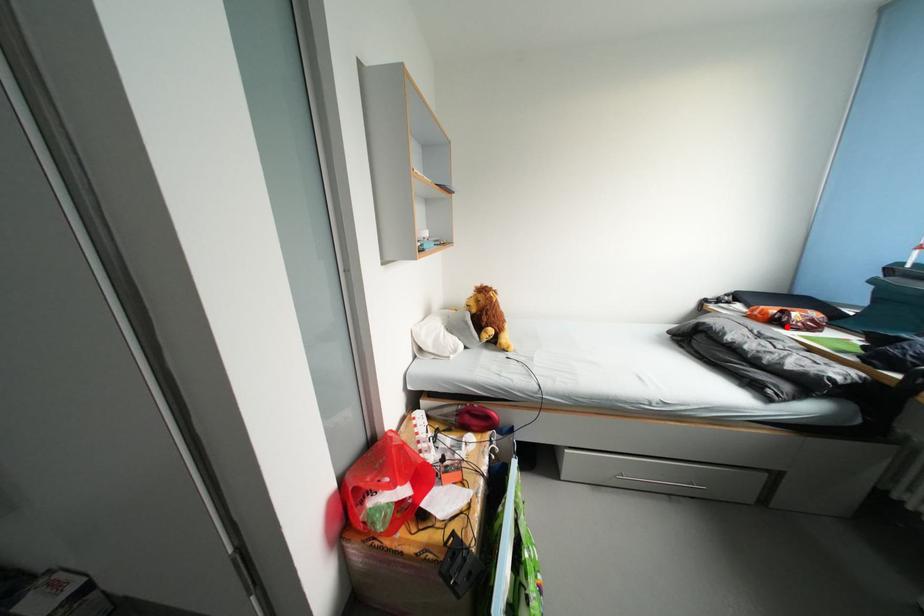
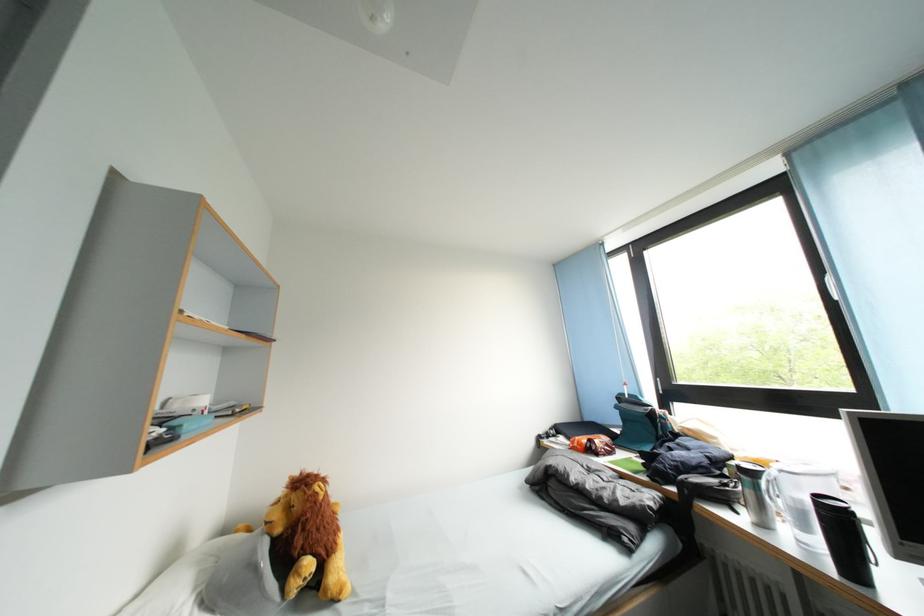
In the second image, find the point that corresponds to the highlighted location in the first image.

(600, 455)